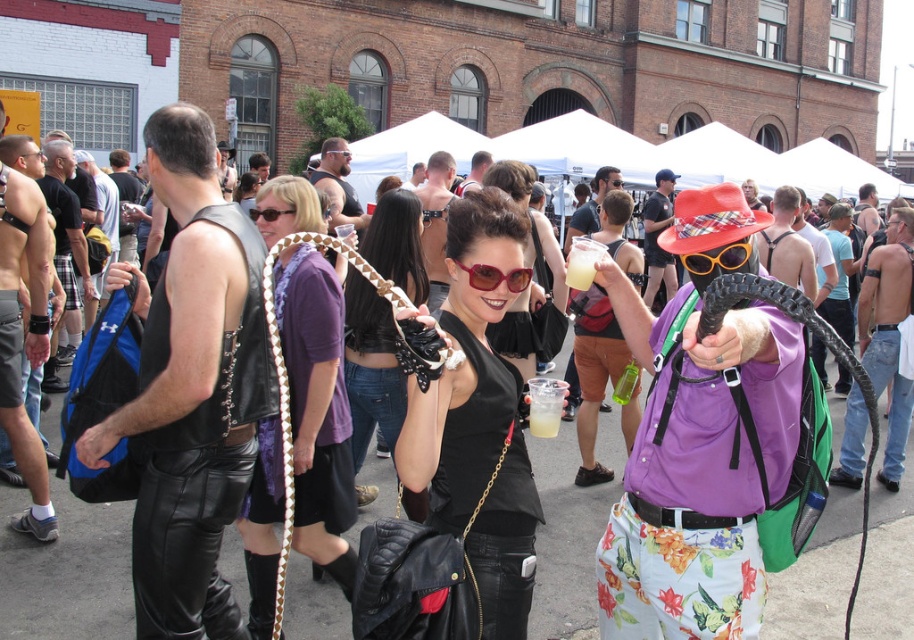
Question: Which of these objects is positioned closest to the purple satin scarf at center?

Choices:
 (A) black plastic goggles at center
 (B) black leather purse at center
 (C) leather belt at center
 (D) matte red sunglasses at center

Answer: (C)

Question: Which object is positioned closest to the purple satin scarf at center?

Choices:
 (A) black leather purse at center
 (B) black plastic goggles at center
 (C) matte red sunglasses at center
 (D) leather belt at center

Answer: (D)

Question: Does leather belt at center appear on the right side of matte red sunglasses at center?

Choices:
 (A) no
 (B) yes

Answer: (A)

Question: Is black leather purse at center to the right of black plastic goggles at center from the viewer's perspective?

Choices:
 (A) yes
 (B) no

Answer: (B)

Question: Which object is the closest to the black plastic goggles at center?

Choices:
 (A) purple satin scarf at center
 (B) black leather purse at center
 (C) leather belt at center

Answer: (B)

Question: Can you confirm if purple satin scarf at center is positioned to the right of matte red sunglasses at center?

Choices:
 (A) no
 (B) yes

Answer: (A)